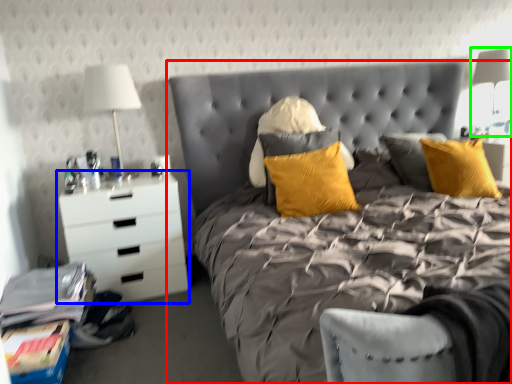
Question: Considering the real-world distances, which object is closest to bed (highlighted by a red box)? chest of drawers (highlighted by a blue box) or bedside lamp (highlighted by a green box).

Choices:
 (A) chest of drawers
 (B) bedside lamp

Answer: (A)